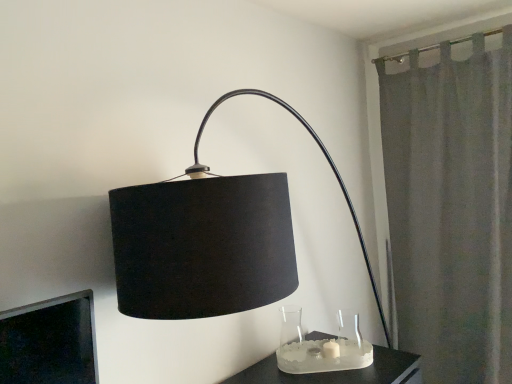
Question: Would you say clear glass vase at lower center, which is the second glass vase from right to left, is inside or outside transparent glass vase at lower center, marked as the 1th glass vase in a right-to-left arrangement?

Choices:
 (A) outside
 (B) inside

Answer: (A)

Question: In terms of width, does clear glass vase at lower center, which is counted as the 1th glass vase, starting from the left, look wider or thinner when compared to transparent glass vase at lower center, marked as the 1th glass vase in a right-to-left arrangement?

Choices:
 (A) thin
 (B) wide

Answer: (B)

Question: Estimate the real-world distances between objects in this image. Which object is closer to the gray fabric curtain at right?

Choices:
 (A) clear glass vase at lower center, which is the second glass vase from right to left
 (B) transparent glass vase at lower center, which is the 2th glass vase in left-to-right order
 (C) satin glass candle holder at lower center

Answer: (B)

Question: Which is farther from the gray fabric curtain at right?

Choices:
 (A) transparent glass vase at lower center, which is the 2th glass vase in left-to-right order
 (B) clear glass vase at lower center, which is counted as the 1th glass vase, starting from the left
 (C) satin glass candle holder at lower center

Answer: (B)